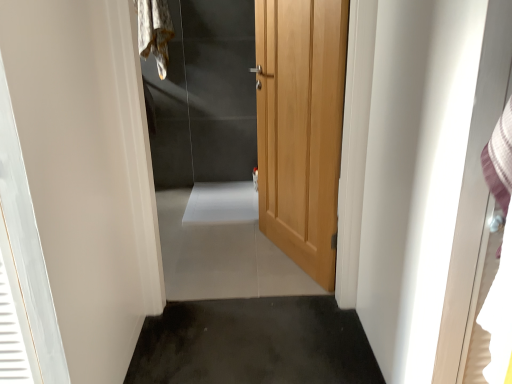
You are a GUI agent. You are given a task and a screenshot of the screen. Output one action in this format:
    pyautogui.click(x=<x>, y=<y>)
    Task: Click on the blank area beneath fuzzy fabric laundry at upper left (from a real-world perspective)
    The height and width of the screenshot is (384, 512).
    Given the screenshot: What is the action you would take?
    pyautogui.click(x=168, y=188)